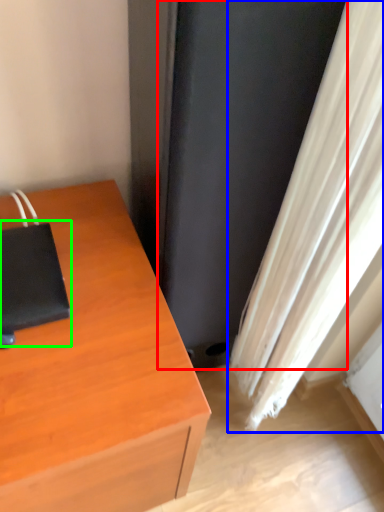
Question: Estimate the real-world distances between objects in this image. Which object is farther from screen door (highlighted by a red box), curtain (highlighted by a blue box) or notebook (highlighted by a green box)?

Choices:
 (A) curtain
 (B) notebook

Answer: (B)